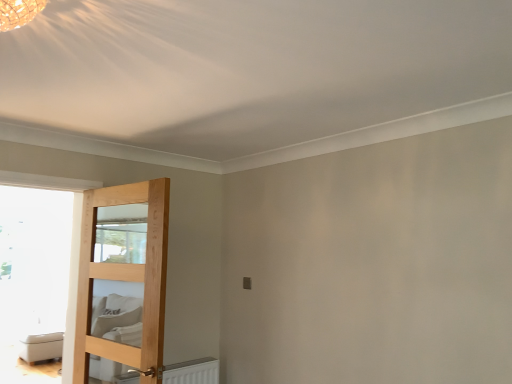
Question: Is white leather ottoman at lower left in contact with natural wood door at left?

Choices:
 (A) no
 (B) yes

Answer: (A)

Question: Are white leather ottoman at lower left and natural wood door at left located far from each other?

Choices:
 (A) yes
 (B) no

Answer: (A)

Question: Does white leather ottoman at lower left appear on the left side of natural wood door at left?

Choices:
 (A) yes
 (B) no

Answer: (A)

Question: Does white leather ottoman at lower left appear on the right side of natural wood door at left?

Choices:
 (A) yes
 (B) no

Answer: (B)

Question: From the image's perspective, is white leather ottoman at lower left over natural wood door at left?

Choices:
 (A) no
 (B) yes

Answer: (A)

Question: Is natural wood door at left completely or partially inside white leather ottoman at lower left?

Choices:
 (A) no
 (B) yes

Answer: (A)

Question: Can you confirm if natural wood door at left is shorter than white leather ottoman at lower left?

Choices:
 (A) no
 (B) yes

Answer: (A)

Question: Is natural wood door at left to the left of white leather ottoman at lower left from the viewer's perspective?

Choices:
 (A) yes
 (B) no

Answer: (B)

Question: Considering the relative sizes of natural wood door at left and white leather ottoman at lower left in the image provided, is natural wood door at left thinner than white leather ottoman at lower left?

Choices:
 (A) yes
 (B) no

Answer: (A)

Question: Is natural wood door at left far from white leather ottoman at lower left?

Choices:
 (A) no
 (B) yes

Answer: (B)

Question: Can you confirm if natural wood door at left is wider than white leather ottoman at lower left?

Choices:
 (A) yes
 (B) no

Answer: (B)

Question: Is natural wood door at left placed right next to white leather ottoman at lower left?

Choices:
 (A) no
 (B) yes

Answer: (A)

Question: In the image, is white leather ottoman at lower left on the left side or the right side of natural wood door at left?

Choices:
 (A) left
 (B) right

Answer: (A)